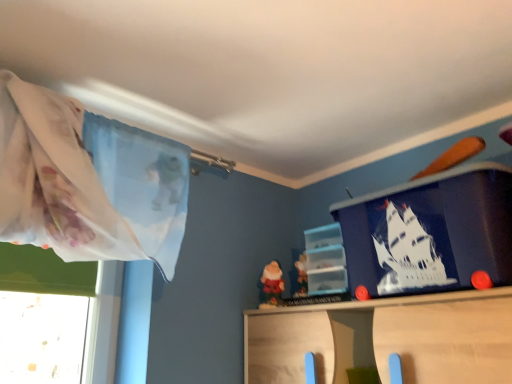
The width and height of the screenshot is (512, 384). Describe the element at coordinates (325, 260) in the screenshot. I see `translucent plastic shelf at center` at that location.

The height and width of the screenshot is (384, 512). Find the location of `translucent plastic shelf at center`. translucent plastic shelf at center is located at coordinates (325, 260).

This screenshot has height=384, width=512. Describe the element at coordinates (430, 232) in the screenshot. I see `blue matte plastic container at upper right` at that location.

Where is `blue matte plastic container at upper right`? The height and width of the screenshot is (384, 512). blue matte plastic container at upper right is located at coordinates (430, 232).

In order to face blue matte plastic container at upper right, should I rotate leftwards or rightwards?

You should rotate right by 21.626 degrees.

The height and width of the screenshot is (384, 512). Identify the location of translucent plastic shelf at center. (325, 260).

Which is more to the left, blue matte plastic container at upper right or translucent plastic shelf at center?

translucent plastic shelf at center is more to the left.

Is blue matte plastic container at upper right positioned in front of translucent plastic shelf at center?

Yes, the depth of blue matte plastic container at upper right is less than that of translucent plastic shelf at center.

Is point (446, 237) closer to viewer compared to point (320, 275)?

Yes, it is in front of point (320, 275).

In the scene shown: From the image's perspective, is blue matte plastic container at upper right beneath translucent plastic shelf at center?

Actually, blue matte plastic container at upper right appears above translucent plastic shelf at center in the image.

From a real-world perspective, who is located lower, blue matte plastic container at upper right or translucent plastic shelf at center?

translucent plastic shelf at center, from a real-world perspective.

Which of these two, blue matte plastic container at upper right or translucent plastic shelf at center, is wider?

Wider between the two is blue matte plastic container at upper right.

Considering the sizes of objects blue matte plastic container at upper right and translucent plastic shelf at center in the image provided, who is taller, blue matte plastic container at upper right or translucent plastic shelf at center?

Standing taller between the two is blue matte plastic container at upper right.

Considering the sizes of objects blue matte plastic container at upper right and translucent plastic shelf at center in the image provided, who is bigger, blue matte plastic container at upper right or translucent plastic shelf at center?

Bigger between the two is blue matte plastic container at upper right.

Is translucent plastic shelf at center located within blue matte plastic container at upper right?

No, blue matte plastic container at upper right does not contain translucent plastic shelf at center.

Consider the image. Is blue matte plastic container at upper right far from translucent plastic shelf at center?

blue matte plastic container at upper right is actually quite close to translucent plastic shelf at center.

Is blue matte plastic container at upper right facing towards translucent plastic shelf at center?

No, blue matte plastic container at upper right is not aimed at translucent plastic shelf at center.

Could you measure the distance between blue matte plastic container at upper right and translucent plastic shelf at center?

The distance of blue matte plastic container at upper right from translucent plastic shelf at center is 28.67 centimeters.

This screenshot has height=384, width=512. I want to click on window screen in front of the translucent plastic shelf at center, so click(430, 232).

Considering the positions of objects translucent plastic shelf at center and blue matte plastic container at upper right in the image provided, who is more to the right, translucent plastic shelf at center or blue matte plastic container at upper right?

blue matte plastic container at upper right is more to the right.

Between translucent plastic shelf at center and blue matte plastic container at upper right, which one is positioned behind?

translucent plastic shelf at center.

Is point (328, 273) closer or farther from the camera than point (370, 277)?

Point (328, 273) is farther from the camera than point (370, 277).

From the picture: From the image's perspective, between translucent plastic shelf at center and blue matte plastic container at upper right, which one is located above?

blue matte plastic container at upper right appears higher in the image.

From a real-world perspective, who is located higher, translucent plastic shelf at center or blue matte plastic container at upper right?

blue matte plastic container at upper right is physically above.

In the scene shown: Which object is wider, translucent plastic shelf at center or blue matte plastic container at upper right?

Wider between the two is blue matte plastic container at upper right.

Which of these two, translucent plastic shelf at center or blue matte plastic container at upper right, stands taller?

Standing taller between the two is blue matte plastic container at upper right.

Is translucent plastic shelf at center bigger than blue matte plastic container at upper right?

No.

Is translucent plastic shelf at center situated inside blue matte plastic container at upper right or outside?

translucent plastic shelf at center is spatially situated outside blue matte plastic container at upper right.

Are translucent plastic shelf at center and blue matte plastic container at upper right far apart?

No, translucent plastic shelf at center is in close proximity to blue matte plastic container at upper right.

Is translucent plastic shelf at center aimed at blue matte plastic container at upper right?

No, translucent plastic shelf at center is not turned towards blue matte plastic container at upper right.

Measure the distance from translucent plastic shelf at center to blue matte plastic container at upper right.

translucent plastic shelf at center is 11.29 inches away from blue matte plastic container at upper right.

Where is `shelf lying behind the blue matte plastic container at upper right`? shelf lying behind the blue matte plastic container at upper right is located at coordinates (325, 260).

Identify the location of window screen on the right of translucent plastic shelf at center. (430, 232).

This screenshot has width=512, height=384. I want to click on shelf below the blue matte plastic container at upper right (from a real-world perspective), so click(325, 260).